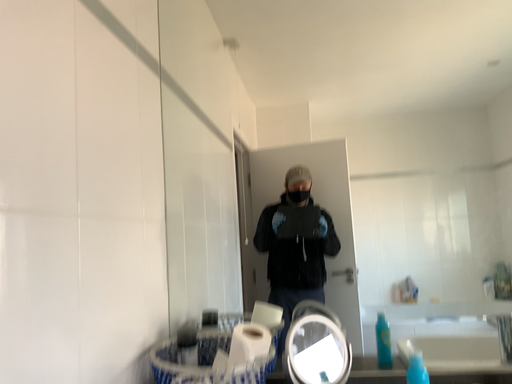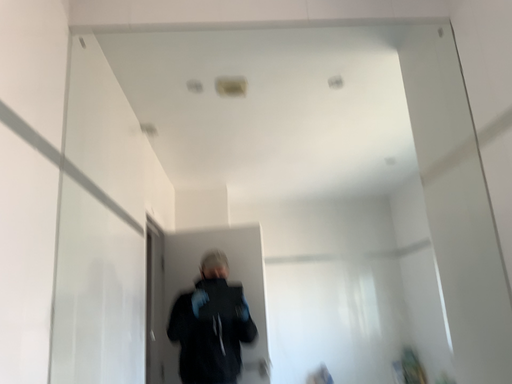
Question: Which way did the camera rotate in the video?

Choices:
 (A) rotated left
 (B) rotated right

Answer: (B)